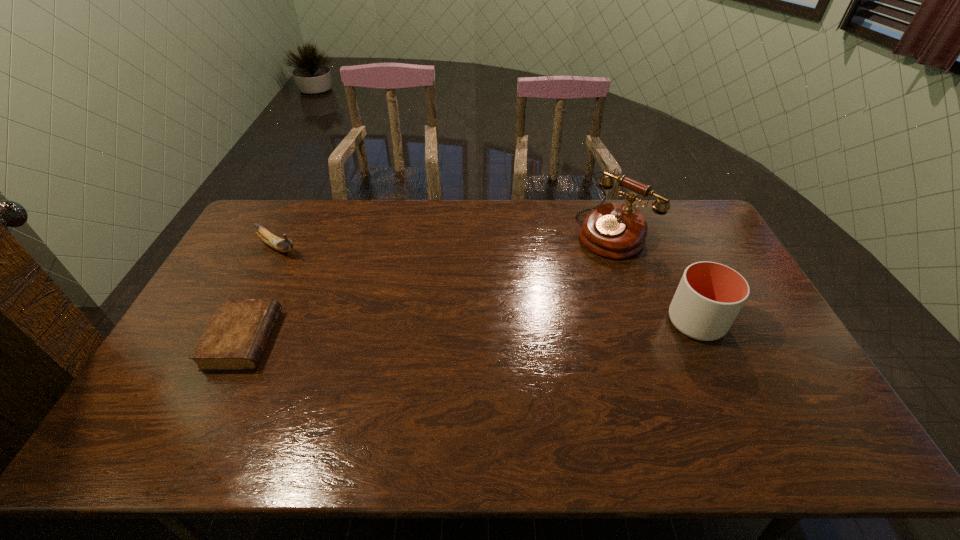
I want to click on vacant space located 0.160m on the dial of the telephone, so click(x=564, y=274).

Image resolution: width=960 pixels, height=540 pixels. Find the location of `free spot located 0.240m on the dial of the telephone`. free spot located 0.240m on the dial of the telephone is located at coordinates (549, 287).

Find the location of a particular element. This screenshot has height=540, width=960. banana present at the far edge is located at coordinates (283, 245).

Where is `telephone that is at the far edge`? telephone that is at the far edge is located at coordinates (614, 230).

This screenshot has height=540, width=960. I want to click on diary located at the left edge, so click(x=235, y=339).

Locate an element on the screen. The height and width of the screenshot is (540, 960). banana present at the left edge is located at coordinates (283, 245).

This screenshot has height=540, width=960. Identify the location of object present at the right edge. (710, 295).

This screenshot has height=540, width=960. What are the coordinates of `object that is at the far left corner` in the screenshot? It's located at (283, 245).

Image resolution: width=960 pixels, height=540 pixels. Identify the location of free space at the far edge of the desktop. tap(363, 221).

The image size is (960, 540). Find the location of `vacant area at the near edge`. vacant area at the near edge is located at coordinates (308, 395).